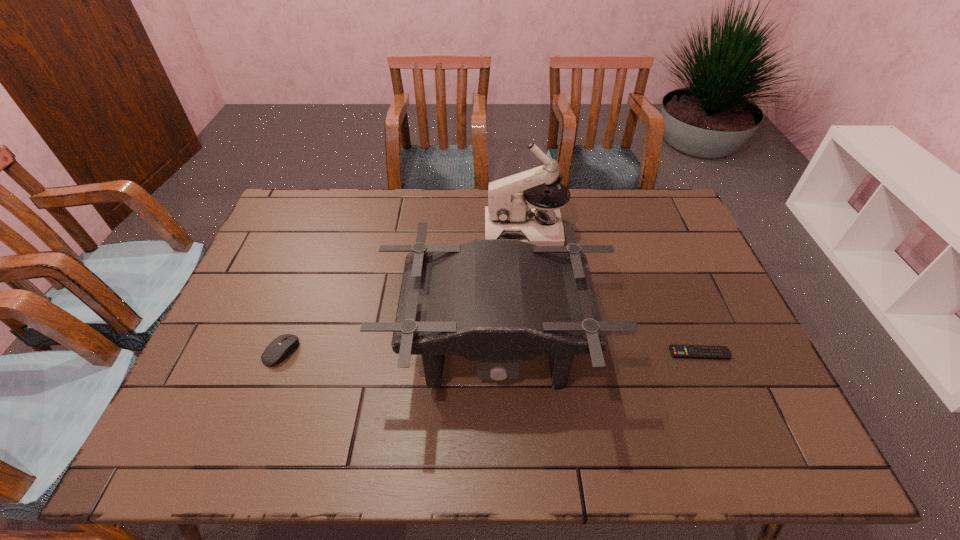
Where is `free space at the right edge`? The image size is (960, 540). free space at the right edge is located at coordinates (663, 245).

In the image, there is a desktop. Identify the location of vacant space at the far left corner. The width and height of the screenshot is (960, 540). (304, 222).

In the image, there is a desktop. Identify the location of vacant space at the near left corner. (239, 423).

The height and width of the screenshot is (540, 960). I want to click on vacant space at the far right corner, so click(643, 213).

Locate an element on the screen. This screenshot has width=960, height=540. vacant area that lies between the microscope and the rightmost object is located at coordinates (612, 292).

You are a GUI agent. You are given a task and a screenshot of the screen. Output one action in this format:
    pyautogui.click(x=<x>, y=<y>)
    Task: Click on the vacant space that's between the remote control and the tallest object
    This screenshot has height=540, width=960.
    Given the screenshot: What is the action you would take?
    pyautogui.click(x=612, y=292)

Locate an element on the screen. The height and width of the screenshot is (540, 960). empty space between the drone and the leftmost object is located at coordinates (388, 349).

The height and width of the screenshot is (540, 960). Identify the location of object that is the second closest to the shortest object. (509, 215).

Locate which object is the closest to the computer equipment. Please provide its 2D coordinates. Your answer should be formatted as a tuple, i.e. [(x, y)], where the tuple contains the x and y coordinates of a point satisfying the conditions above.

[(496, 301)]

Where is `free location that satisfies the following two spatial constraints: 1. at the eyepiece of the tallest object; 2. with a camera mounted on the underside of the drone`? Image resolution: width=960 pixels, height=540 pixels. free location that satisfies the following two spatial constraints: 1. at the eyepiece of the tallest object; 2. with a camera mounted on the underside of the drone is located at coordinates [x=538, y=346].